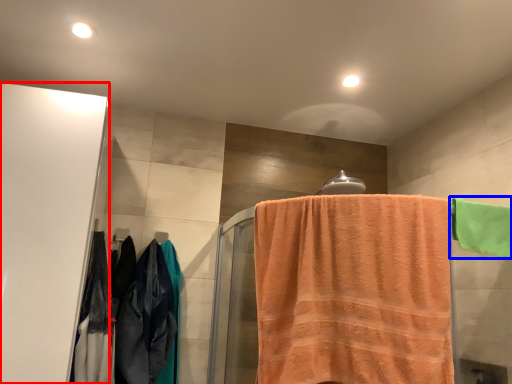
Question: Among these objects, which one is nearest to the camera, screen door (highlighted by a red box) or towel (highlighted by a blue box)?

Choices:
 (A) screen door
 (B) towel

Answer: (A)